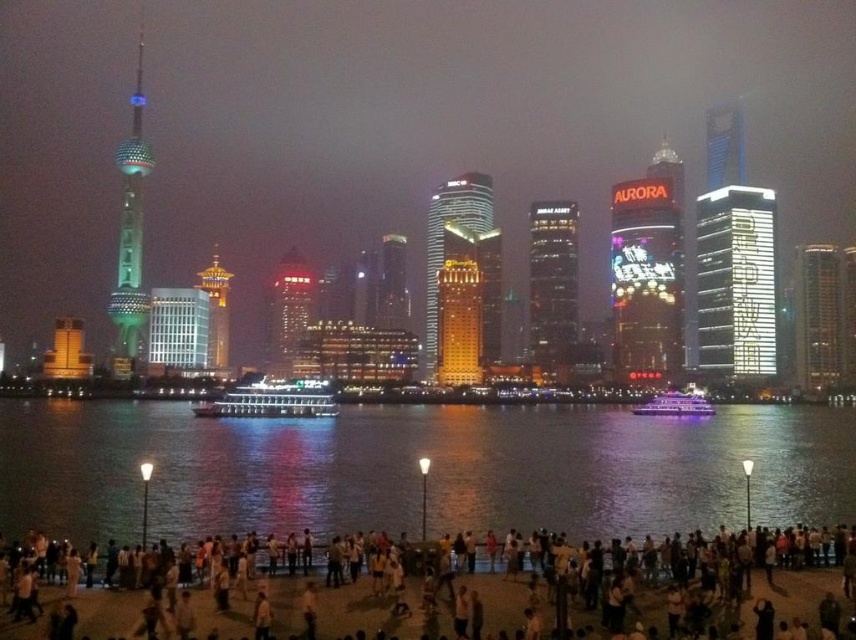
Is clear water at lower center further to the viewer compared to metallic glass skyscraper at right?

That is False.

Is point (547, 417) less distant than point (807, 282)?

Yes, point (547, 417) is in front of point (807, 282).

Find the location of a particular element. Image resolution: width=856 pixels, height=640 pixels. clear water at lower center is located at coordinates (417, 468).

Does point (837, 440) come in front of point (611, 268)?

Yes.

Identify the location of clear water at lower center. (417, 468).

Does white glass skyscraper at right lie behind matte glass skyscraper at center?

Yes, white glass skyscraper at right is further from the viewer.

Image resolution: width=856 pixels, height=640 pixels. Describe the element at coordinates (736, 282) in the screenshot. I see `white glass skyscraper at right` at that location.

Find the location of a particular element. This screenshot has width=856, height=640. white glass skyscraper at right is located at coordinates (736, 282).